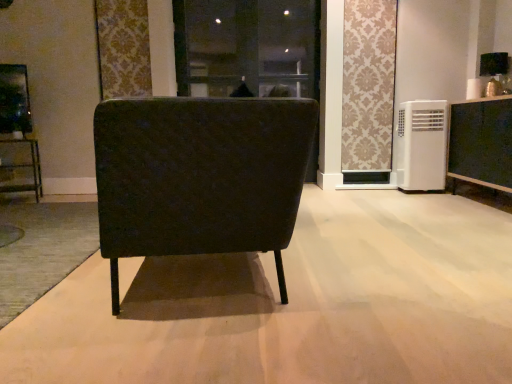
Question: Is white plastic air conditioner at right to the right of black fabric screen door at center from the viewer's perspective?

Choices:
 (A) yes
 (B) no

Answer: (A)

Question: Is white plastic air conditioner at right facing away from black fabric screen door at center?

Choices:
 (A) yes
 (B) no

Answer: (B)

Question: Does white plastic air conditioner at right lie in front of black fabric screen door at center?

Choices:
 (A) yes
 (B) no

Answer: (A)

Question: Is white plastic air conditioner at right positioned behind black fabric screen door at center?

Choices:
 (A) no
 (B) yes

Answer: (A)

Question: Does white plastic air conditioner at right have a lesser height compared to black fabric screen door at center?

Choices:
 (A) no
 (B) yes

Answer: (B)

Question: Does white plastic air conditioner at right have a greater width compared to black fabric screen door at center?

Choices:
 (A) no
 (B) yes

Answer: (B)

Question: Is there a large distance between white plastic air conditioner at right and matte black chair at center?

Choices:
 (A) no
 (B) yes

Answer: (B)

Question: From a real-world perspective, is white plastic air conditioner at right below matte black chair at center?

Choices:
 (A) yes
 (B) no

Answer: (B)

Question: Is matte black chair at center located within white plastic air conditioner at right?

Choices:
 (A) yes
 (B) no

Answer: (B)

Question: Considering the relative sizes of white plastic air conditioner at right and matte black chair at center in the image provided, is white plastic air conditioner at right bigger than matte black chair at center?

Choices:
 (A) yes
 (B) no

Answer: (B)

Question: Is white plastic air conditioner at right at the right side of matte black chair at center?

Choices:
 (A) yes
 (B) no

Answer: (A)

Question: Is white plastic air conditioner at right positioned beyond the bounds of matte black chair at center?

Choices:
 (A) no
 (B) yes

Answer: (B)

Question: Does matte black cabinet at right touch white plastic air conditioner at right?

Choices:
 (A) no
 (B) yes

Answer: (A)